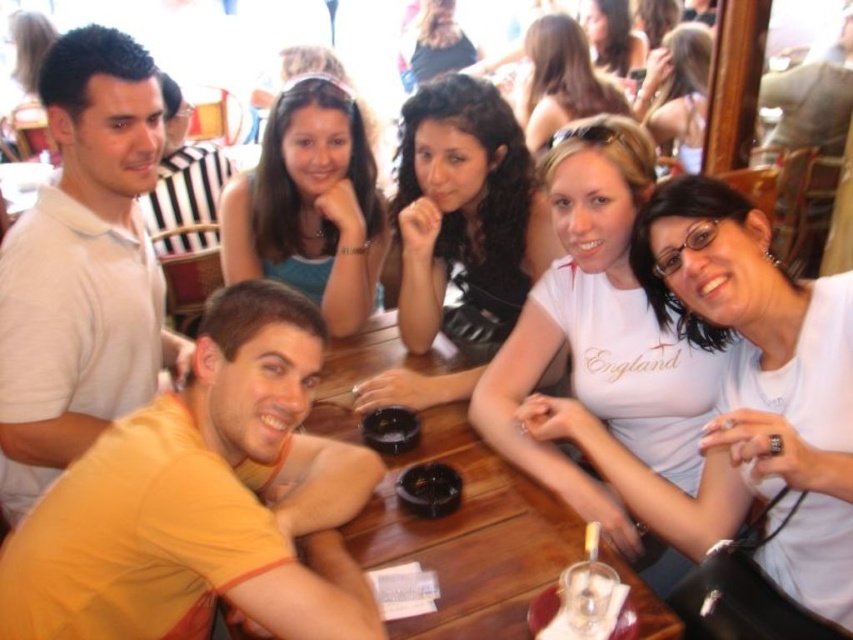
Question: Which object appears farthest from the camera in this image?

Choices:
 (A) curly hair at upper center
 (B) orange cotton shirt at lower left
 (C) matte black shirt at upper center

Answer: (C)

Question: Does white cotton shirt at center have a lesser width compared to clear glass at lower center?

Choices:
 (A) no
 (B) yes

Answer: (A)

Question: Is matte black shirt at upper center further to the viewer compared to black glass ashtray at center?

Choices:
 (A) no
 (B) yes

Answer: (B)

Question: Which object appears farthest from the camera in this image?

Choices:
 (A) orange cotton shirt at lower left
 (B) white cotton shirt at center

Answer: (B)

Question: Which object appears closest to the camera in this image?

Choices:
 (A) curly hair at center
 (B) matte white shirt at left
 (C) orange cotton shirt at lower left

Answer: (C)

Question: Is wooden table at center to the left of clear glass at lower center from the viewer's perspective?

Choices:
 (A) yes
 (B) no

Answer: (A)